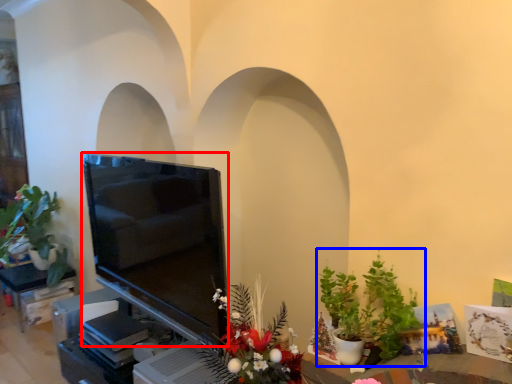
Question: Which of the following is the farthest to the observer, television (highlighted by a red box) or houseplant (highlighted by a blue box)?

Choices:
 (A) television
 (B) houseplant

Answer: (A)